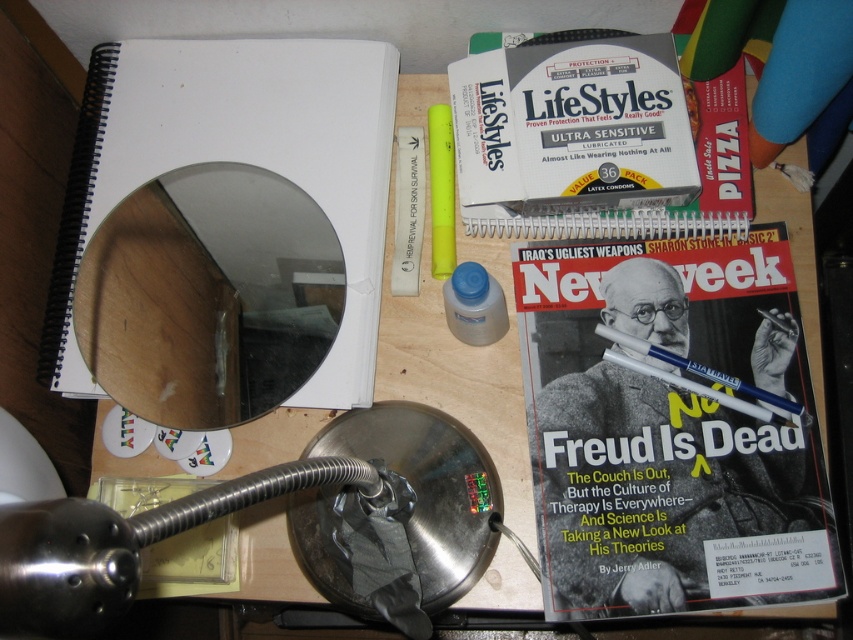
Can you confirm if matte paper magazine at center right is positioned below yellow matte highlighter at center?

Correct, matte paper magazine at center right is located below yellow matte highlighter at center.

What do you see at coordinates (669, 429) in the screenshot?
I see `matte paper magazine at center right` at bounding box center [669, 429].

Who is more distant from viewer, [763,241] or [432,154]?

The point [432,154] is behind.

I want to click on matte paper magazine at center right, so click(669, 429).

Between white paper notebook at upper left and yellow matte highlighter at center, which one has more height?

Standing taller between the two is white paper notebook at upper left.

Can you confirm if white paper notebook at upper left is positioned below yellow matte highlighter at center?

Correct, white paper notebook at upper left is located below yellow matte highlighter at center.

Does point (238, 323) come in front of point (450, 147)?

Yes, point (238, 323) is in front of point (450, 147).

The height and width of the screenshot is (640, 853). I want to click on white paper notebook at upper left, so click(x=224, y=228).

Which is behind, point (309, 502) or point (622, 344)?

Positioned behind is point (622, 344).

Is metallic silver magnifying glass at lower center to the right of blue plastic pen at center from the viewer's perspective?

In fact, metallic silver magnifying glass at lower center is to the left of blue plastic pen at center.

Between point (466, 518) and point (671, 378), which one is positioned behind?

Positioned behind is point (671, 378).

Image resolution: width=853 pixels, height=640 pixels. I want to click on metallic silver magnifying glass at lower center, so click(399, 515).